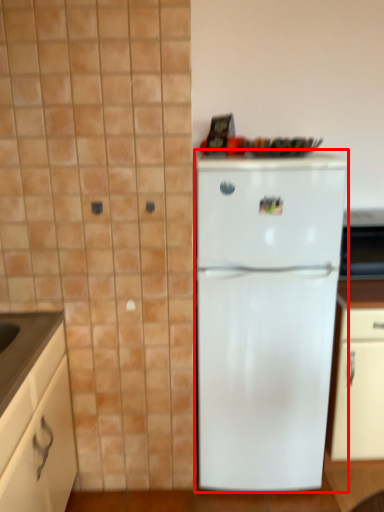
Question: From the image, what is the correct spatial relationship of refrigerator (annotated by the red box) in relation to cabinetry?

Choices:
 (A) left
 (B) right

Answer: (B)